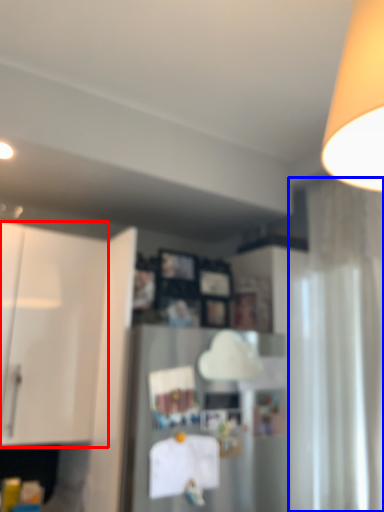
Question: Among these objects, which one is farthest to the camera, cabinetry (highlighted by a red box) or curtain (highlighted by a blue box)?

Choices:
 (A) cabinetry
 (B) curtain

Answer: (A)